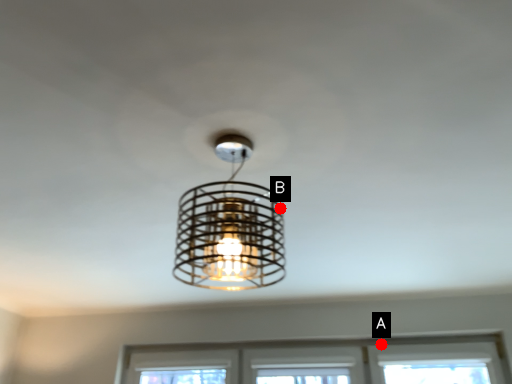
Question: Two points are circled on the image, labeled by A and B beside each circle. Which point is closer to the camera taking this photo?

Choices:
 (A) A is closer
 (B) B is closer

Answer: (B)